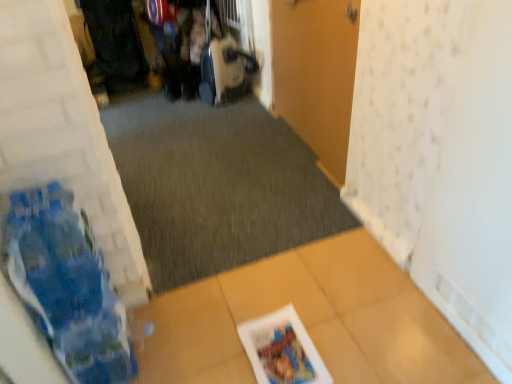
Where is `free space above printed paper magazine at lower center (from a real-world perspective)`? This screenshot has height=384, width=512. free space above printed paper magazine at lower center (from a real-world perspective) is located at coordinates (283, 347).